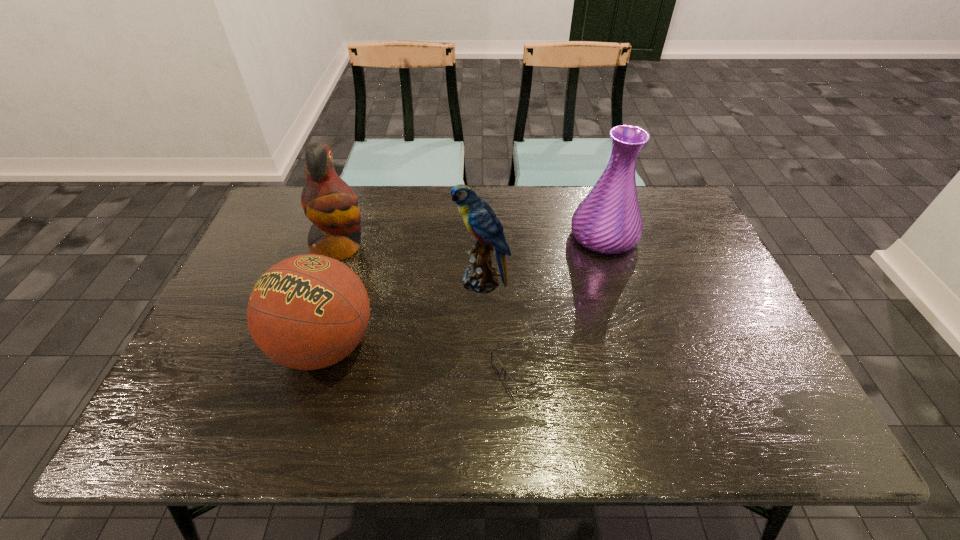
You are a GUI agent. You are given a task and a screenshot of the screen. Output one action in this format:
    pyautogui.click(x=<x>, y=<y>)
    Task: Click on the vacant area located 0.060m on the face of the right parrot
    The image size is (960, 540).
    Given the screenshot: What is the action you would take?
    pyautogui.click(x=434, y=281)

You are a GUI agent. You are given a task and a screenshot of the screen. Output one action in this format:
    pyautogui.click(x=<x>, y=<y>)
    Task: Click on the blank area located on the back of the fourth tallest object
    This screenshot has height=540, width=960.
    Given the screenshot: What is the action you would take?
    pyautogui.click(x=345, y=278)

Identify the location of vacant space located 0.250m with the lenses facing outward on the shortest object. This screenshot has width=960, height=540. (382, 372).

What are the coordinates of `free space located 0.060m with the lenses facing outward on the shortest object` in the screenshot? It's located at (465, 372).

Where is `free point located 0.350m with the lenses facing outward on the shortest object`? free point located 0.350m with the lenses facing outward on the shortest object is located at coordinates (x=339, y=372).

The height and width of the screenshot is (540, 960). What are the coordinates of `object that is at the far edge` in the screenshot? It's located at (608, 220).

You are a GUI agent. You are given a task and a screenshot of the screen. Output one action in this format:
    pyautogui.click(x=<x>, y=<y>)
    Task: Click on the vacant area at the far edge of the desktop
    This screenshot has width=960, height=540.
    Given the screenshot: What is the action you would take?
    pyautogui.click(x=395, y=225)

Image resolution: width=960 pixels, height=540 pixels. I want to click on vacant space at the near edge of the desktop, so click(674, 443).

Locate an element on the screen. Image resolution: width=960 pixels, height=540 pixels. free space at the left edge of the desktop is located at coordinates (275, 257).

Locate an element on the screen. vacant space at the right edge of the desktop is located at coordinates (683, 247).